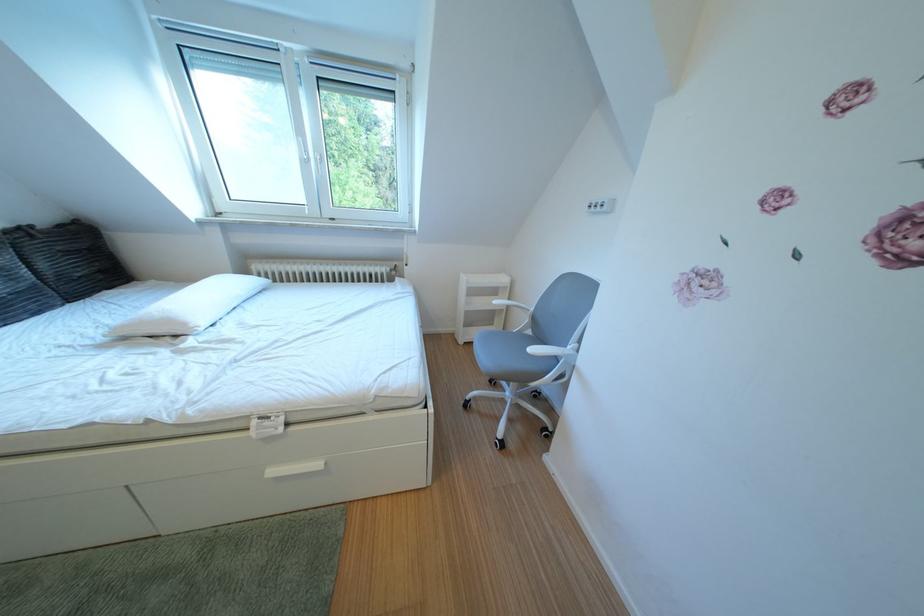
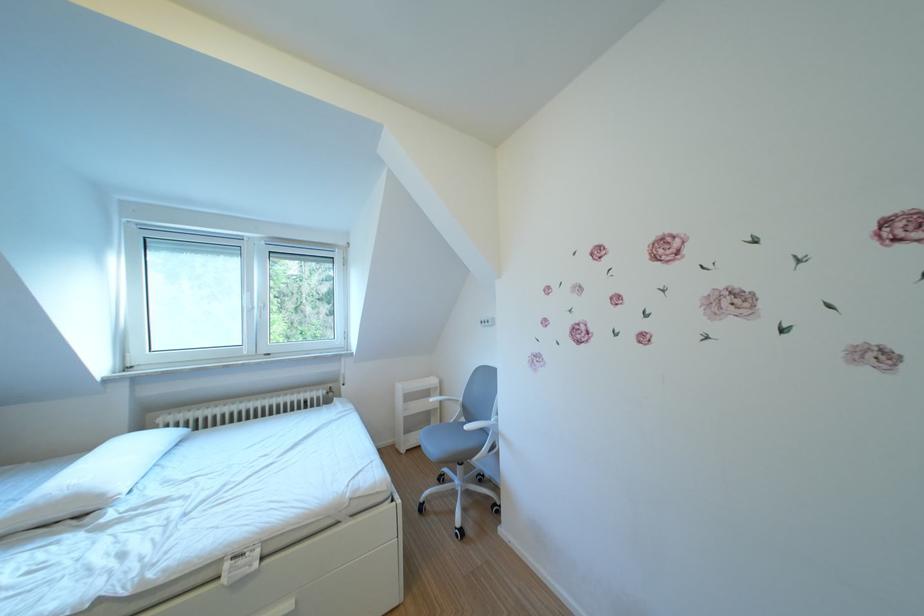
The point at (321, 156) is marked in the first image. Where is the corresponding point in the second image?

(265, 307)